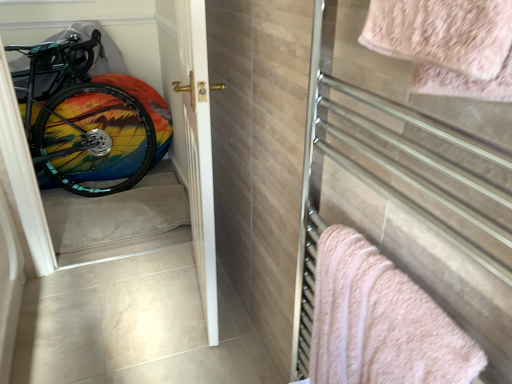
Identify the location of vacant area on top of pink fluffy towel at right, acting as the 1th towel starting from the back (from a real-world perspective). (393, 283).